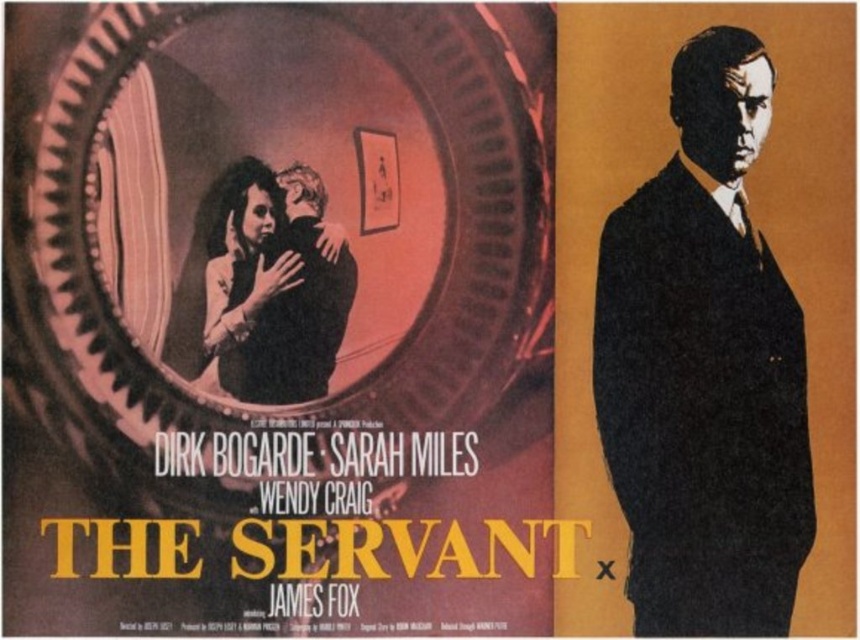
Question: Estimate the real-world distances between objects in this image. Which object is farther from the smooth black suit at center?

Choices:
 (A) black paper at center
 (B) matte black suit at right

Answer: (A)

Question: Which point appears closest to the camera in this image?

Choices:
 (A) (218, 381)
 (B) (605, 564)

Answer: (A)

Question: Can you confirm if matte black suit at right is smaller than smooth black suit at center?

Choices:
 (A) no
 (B) yes

Answer: (A)

Question: Is smooth black suit at center below black paper at center?

Choices:
 (A) no
 (B) yes

Answer: (A)

Question: Which object is the closest to the smooth black suit at center?

Choices:
 (A) matte black suit at right
 (B) black paper at center

Answer: (A)

Question: Does matte black suit at right appear on the left side of black paper at center?

Choices:
 (A) no
 (B) yes

Answer: (A)